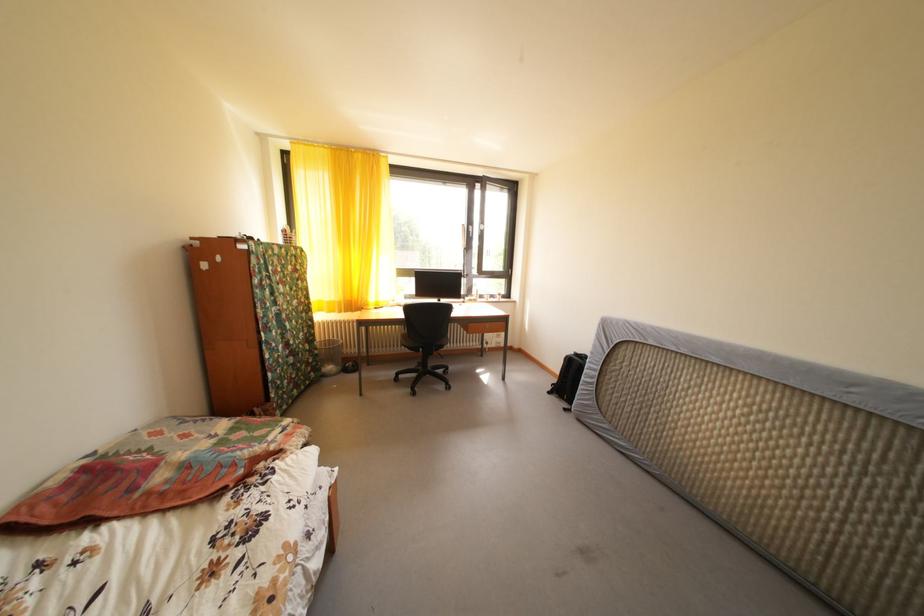
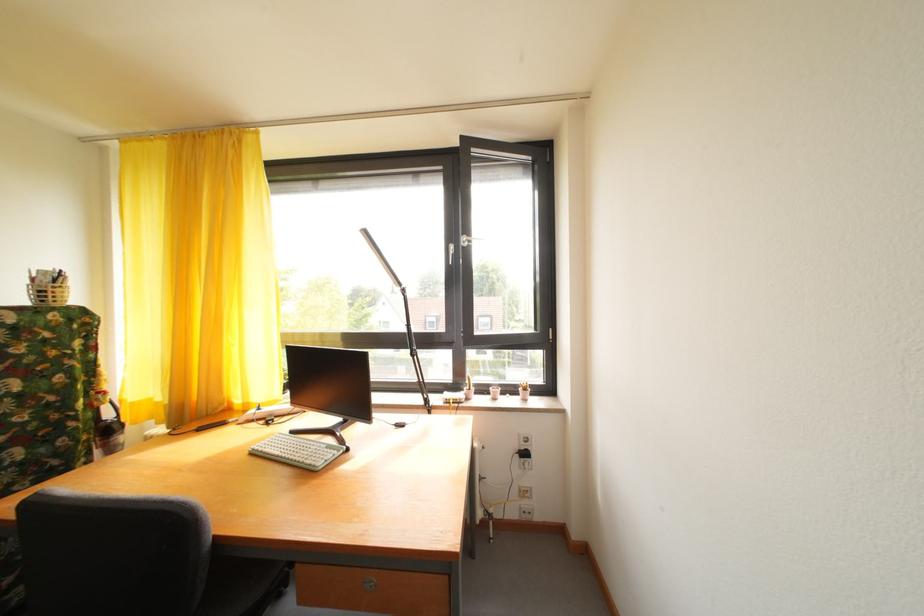
Where in the second image is the point corresponding to [490,302] from the first image?

(492, 395)